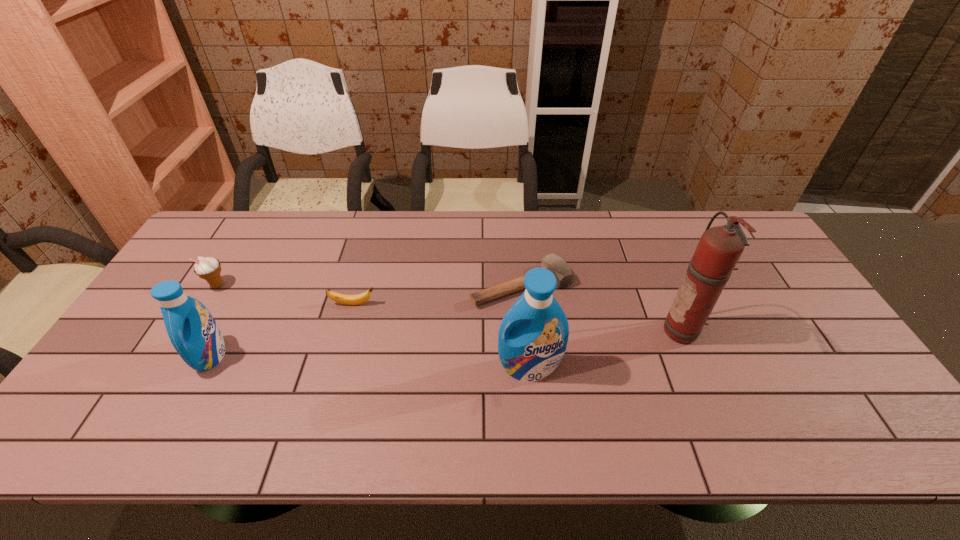
Where is `free space at the near edge`? This screenshot has width=960, height=540. free space at the near edge is located at coordinates (210, 407).

At what (x,y) coordinates should I click in order to perform the action: click on vacant space at the right edge of the desktop. Please return your answer as a coordinate pair (x, y). The height and width of the screenshot is (540, 960). Looking at the image, I should click on (794, 346).

Image resolution: width=960 pixels, height=540 pixels. Identify the location of vacant space at the far left corner of the desktop. (255, 224).

Image resolution: width=960 pixels, height=540 pixels. Identify the location of free space at the far right corner of the desktop. (755, 233).

In the image, there is a desktop. At what (x,y) coordinates should I click in order to perform the action: click on vacant space at the near right corner. Please return your answer as a coordinate pair (x, y). This screenshot has height=540, width=960. Looking at the image, I should click on (814, 408).

Where is `free spot between the fire extinguisher and the mallet`? free spot between the fire extinguisher and the mallet is located at coordinates (603, 309).

Locate an element on the screen. vacant region between the fourth object from right to left and the shortest object is located at coordinates (438, 295).

You are a GUI agent. You are given a task and a screenshot of the screen. Output one action in this format:
    pyautogui.click(x=<x>, y=<y>)
    Task: Click on the vacant space that's between the icecream and the mallet
    This screenshot has width=960, height=540.
    Given the screenshot: What is the action you would take?
    pyautogui.click(x=370, y=286)

The height and width of the screenshot is (540, 960). Identify the location of free space between the tallest object and the fourth tallest object. (450, 308).

Image resolution: width=960 pixels, height=540 pixels. I want to click on free spot between the shortest object and the icecream, so click(x=370, y=286).